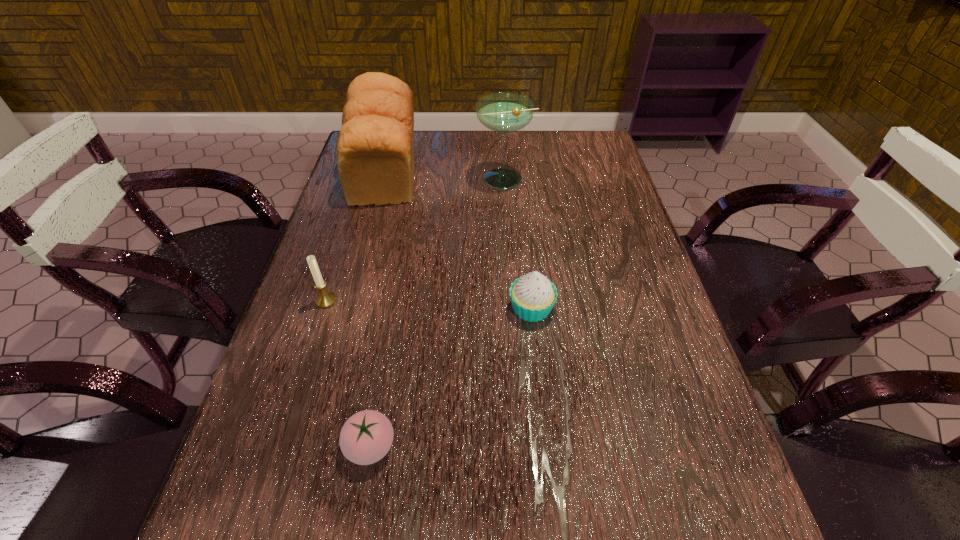
The width and height of the screenshot is (960, 540). I want to click on free region located 0.070m on the front of the tomato, so click(357, 521).

This screenshot has width=960, height=540. I want to click on bread situated at the far edge, so click(375, 148).

The height and width of the screenshot is (540, 960). What are the coordinates of `martini that is positioned at the far edge` in the screenshot? It's located at (503, 112).

At what (x,y) coordinates should I click in order to perform the action: click on bread located in the left edge section of the desktop. Please return your answer as a coordinate pair (x, y). This screenshot has height=540, width=960. Looking at the image, I should click on (375, 148).

The height and width of the screenshot is (540, 960). In order to click on candle holder that is at the left edge in this screenshot , I will do `click(325, 299)`.

You are a GUI agent. You are given a task and a screenshot of the screen. Output one action in this format:
    pyautogui.click(x=<x>, y=<y>)
    Task: Click on the object that is at the far left corner
    This screenshot has height=540, width=960.
    Given the screenshot: What is the action you would take?
    pyautogui.click(x=375, y=148)

The width and height of the screenshot is (960, 540). What are the coordinates of `free region at the far edge of the desktop` in the screenshot? It's located at (516, 151).

The height and width of the screenshot is (540, 960). I want to click on vacant position at the left edge of the desktop, so click(284, 332).

Where is `free spot at the right edge of the desktop`? The image size is (960, 540). free spot at the right edge of the desktop is located at coordinates (595, 183).

The height and width of the screenshot is (540, 960). Identify the location of vacant area at the far right corner of the desktop. (561, 148).